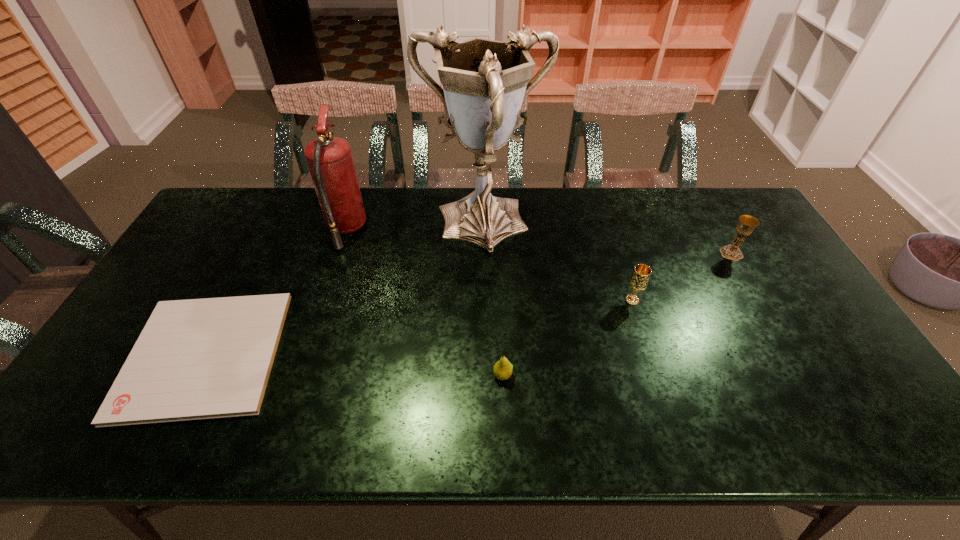
Locate an element on the screen. This screenshot has width=960, height=540. unoccupied area between the rightmost object and the pear is located at coordinates (617, 314).

Locate an element on the screen. free space between the tallest object and the shortest object is located at coordinates (344, 291).

Find the location of `blank region between the tallest object and the nearer chalice`. blank region between the tallest object and the nearer chalice is located at coordinates 557,264.

The width and height of the screenshot is (960, 540). I want to click on unoccupied area between the rightmost object and the pear, so click(x=617, y=314).

The width and height of the screenshot is (960, 540). Identify the location of blank region between the pear and the tallest object. (492, 301).

Locate an element on the screen. Image resolution: width=960 pixels, height=540 pixels. object identified as the closest to the tallest object is located at coordinates (329, 159).

The image size is (960, 540). What are the coordinates of `object identified as the second closest to the tallest object` in the screenshot? It's located at (638, 282).

Find the location of a particular element. The height and width of the screenshot is (540, 960). free space that satisfies the following two spatial constraints: 1. at the front of the second tallest object where the nozzle is aimed; 2. on the right side of the pear is located at coordinates (299, 375).

Locate an element on the screen. The width and height of the screenshot is (960, 540). blank area in the image that satisfies the following two spatial constraints: 1. at the front of the fire extinguisher where the nozzle is aimed; 2. on the left side of the right chalice is located at coordinates (338, 253).

Find the location of a particular element. Image resolution: width=960 pixels, height=540 pixels. vacant space that satisfies the following two spatial constraints: 1. on the back side of the fifth tallest object; 2. at the front of the second tallest object where the nozzle is aimed is located at coordinates (497, 230).